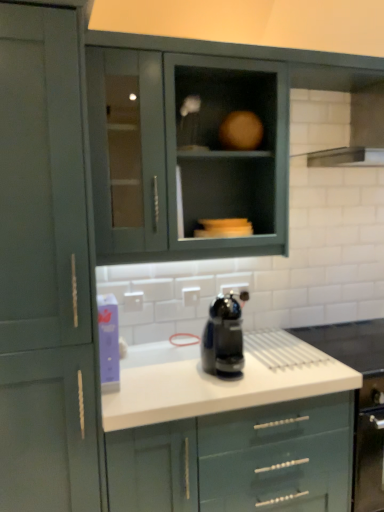
Question: Which direction should I rotate to look at white glossy countertop at center, marked as the 3th cabinetry in a left-to-right arrangement?

Choices:
 (A) left
 (B) right

Answer: (B)

Question: From a real-world perspective, is black glossy coffee maker at center under stainless steel exhaust hood at upper right?

Choices:
 (A) yes
 (B) no

Answer: (A)

Question: Is black glossy coffee maker at center wider than stainless steel exhaust hood at upper right?

Choices:
 (A) no
 (B) yes

Answer: (A)

Question: Considering the relative sizes of black glossy coffee maker at center and stainless steel exhaust hood at upper right in the image provided, is black glossy coffee maker at center smaller than stainless steel exhaust hood at upper right?

Choices:
 (A) no
 (B) yes

Answer: (B)

Question: Is black glossy coffee maker at center far away from stainless steel exhaust hood at upper right?

Choices:
 (A) no
 (B) yes

Answer: (B)

Question: Is black glossy coffee maker at center at the right side of stainless steel exhaust hood at upper right?

Choices:
 (A) no
 (B) yes

Answer: (A)

Question: From the image's perspective, is black glossy coffee maker at center above stainless steel exhaust hood at upper right?

Choices:
 (A) yes
 (B) no

Answer: (B)

Question: Can you confirm if matte green cabinet at left, the 1th cabinetry viewed from the left, is thinner than black glossy coffee maker at center?

Choices:
 (A) no
 (B) yes

Answer: (A)

Question: From a real-world perspective, is matte green cabinet at left, the 1th cabinetry viewed from the left, on top of black glossy coffee maker at center?

Choices:
 (A) yes
 (B) no

Answer: (A)

Question: Considering the relative sizes of matte green cabinet at left, the 1th cabinetry viewed from the left, and black glossy coffee maker at center in the image provided, is matte green cabinet at left, the 1th cabinetry viewed from the left, taller than black glossy coffee maker at center?

Choices:
 (A) yes
 (B) no

Answer: (A)

Question: From a real-world perspective, does matte green cabinet at left, the third cabinetry from the right, sit lower than black glossy coffee maker at center?

Choices:
 (A) yes
 (B) no

Answer: (B)

Question: Would you say black glossy coffee maker at center is part of matte green cabinet at left, the 1th cabinetry viewed from the left,'s contents?

Choices:
 (A) yes
 (B) no

Answer: (B)

Question: Is matte green cabinet at left, the third cabinetry from the right, positioned beyond the bounds of black glossy coffee maker at center?

Choices:
 (A) yes
 (B) no

Answer: (A)

Question: From a real-world perspective, is matte gray cabinet at upper center, which is the second cabinetry from left to right, on matte green cabinet at left, the third cabinetry from the right?

Choices:
 (A) no
 (B) yes

Answer: (B)